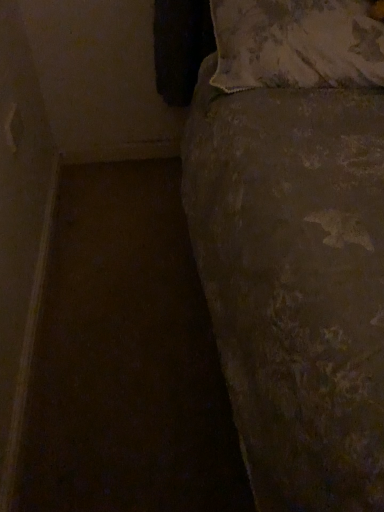
Image resolution: width=384 pixels, height=512 pixels. I want to click on fluffy beige pillow at upper right, so click(296, 44).

What do you see at coordinates (296, 44) in the screenshot?
I see `fluffy beige pillow at upper right` at bounding box center [296, 44].

Measure the distance between point (341, 71) and camera.

A distance of 38.86 inches exists between point (341, 71) and camera.

Locate an element on the screen. fluffy beige pillow at upper right is located at coordinates (296, 44).